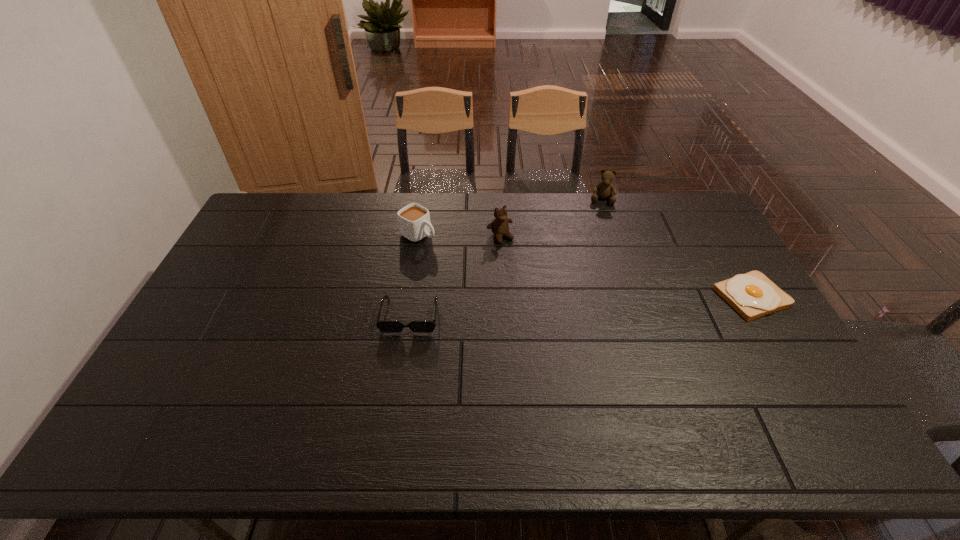
You are a GUI agent. You are given a task and a screenshot of the screen. Output one action in this format:
    pyautogui.click(x=<x>, y=<y>)
    Task: Click on the object that is at the right edge
    The height and width of the screenshot is (540, 960).
    Given the screenshot: What is the action you would take?
    pyautogui.click(x=753, y=295)

Locate an element on the screen. Image resolution: width=960 pixels, height=540 pixels. vacant space at the far edge is located at coordinates (357, 215).

Locate an element on the screen. vacant space at the near edge of the desktop is located at coordinates (619, 380).

The width and height of the screenshot is (960, 540). I want to click on vacant region at the left edge, so click(254, 302).

I want to click on vacant space at the far right corner, so click(680, 193).

Where is `free space at the near right corner`? Image resolution: width=960 pixels, height=540 pixels. free space at the near right corner is located at coordinates tap(789, 394).

Identify the location of free space between the cup and the fourth tallest object. The width and height of the screenshot is (960, 540). (414, 275).

This screenshot has width=960, height=540. In order to click on free space between the second shortest object and the toast in this screenshot , I will do `click(581, 306)`.

I want to click on vacant region between the left teddy bear and the farthest object, so click(x=551, y=218).

This screenshot has width=960, height=540. I want to click on free space between the sunglasses and the shortest object, so click(x=581, y=306).